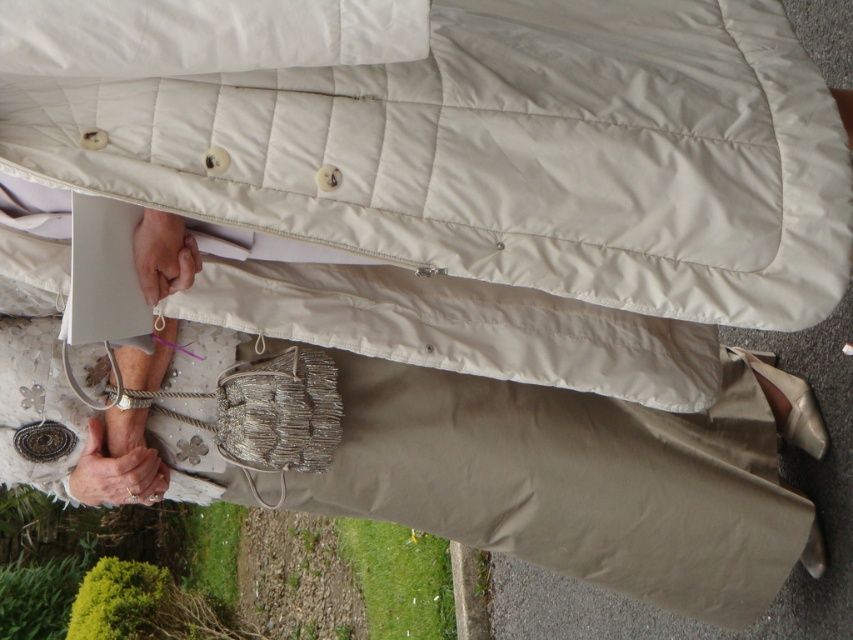
Which is more to the right, white quilted pillow at upper center or white fabric hand at lower left?

white quilted pillow at upper center

Is white quilted pillow at upper center shorter than white fabric hand at lower left?

Indeed, white quilted pillow at upper center has a lesser height compared to white fabric hand at lower left.

This screenshot has width=853, height=640. In order to click on white quilted pillow at upper center in this screenshot , I will do `click(204, 35)`.

This screenshot has height=640, width=853. Find the location of `white quilted pillow at upper center`. white quilted pillow at upper center is located at coordinates (204, 35).

Between point (160, 458) and point (138, 241), which one is positioned in front?

Point (138, 241) is in front.

Is point (140, 488) positioned in front of point (167, 252)?

No, it is not.

The height and width of the screenshot is (640, 853). I want to click on white fabric hand at lower left, so click(115, 474).

Who is lower down, white quilted pillow at upper center or matte beige hand at center?

matte beige hand at center

The width and height of the screenshot is (853, 640). Identify the location of white quilted pillow at upper center. (204, 35).